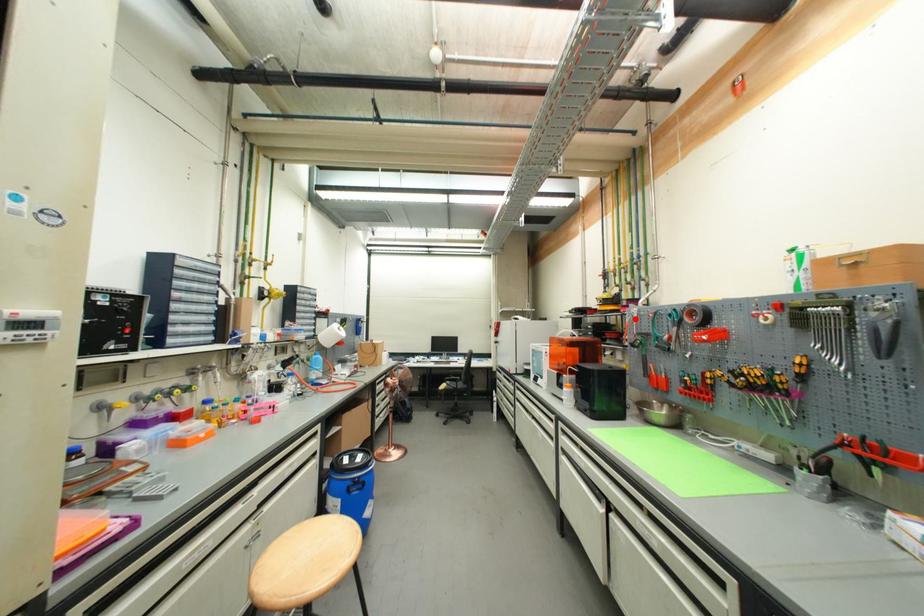
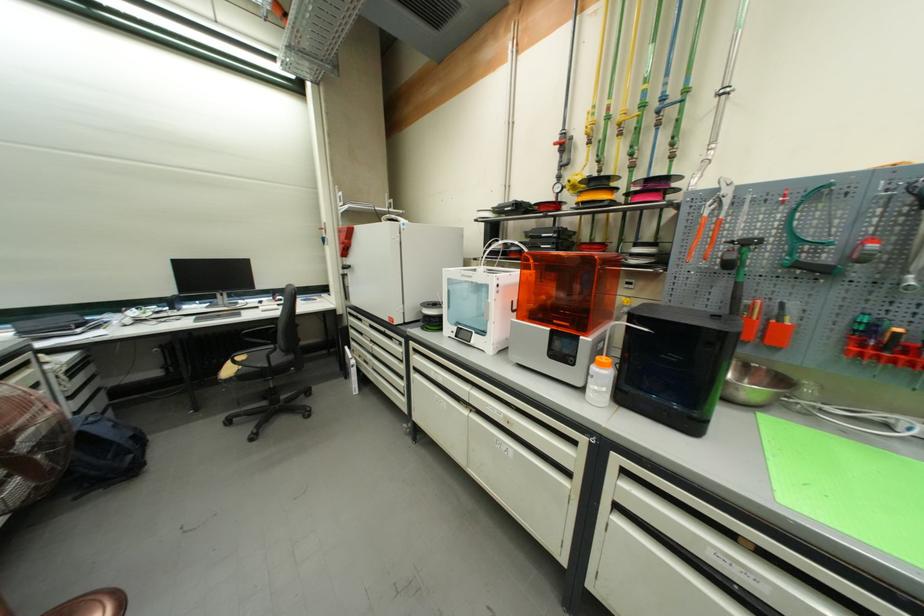
Where in the second image is the point corresponding to the highlighted location from the first image?

(719, 208)